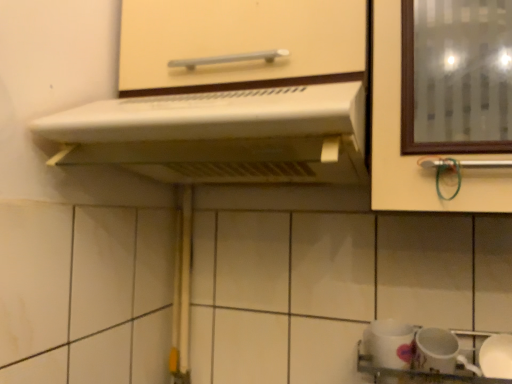
Question: From a real-world perspective, is white glossy mug at lower right, which appears as the second tableware when viewed from the right, above or below white glossy sink at lower right?

Choices:
 (A) above
 (B) below

Answer: (A)

Question: Considering their positions, is white glossy mug at lower right, placed as the first tableware when sorted from left to right, located in front of or behind white glossy sink at lower right?

Choices:
 (A) front
 (B) behind

Answer: (B)

Question: Which of these objects is positioned farthest from the white plastic range hood at upper center?

Choices:
 (A) white glossy sink at lower right
 (B) white glossy mug at lower right, placed as the first tableware when sorted from left to right
 (C) white glossy mug at lower right, the first tableware in the right-to-left sequence
 (D) matte white cabinet handle at upper center

Answer: (C)

Question: Estimate the real-world distances between objects in this image. Which object is closer to the white glossy mug at lower right, arranged as the second tableware when viewed from the left?

Choices:
 (A) white glossy sink at lower right
 (B) white glossy mug at lower right, placed as the first tableware when sorted from left to right
 (C) white plastic range hood at upper center
 (D) matte white cabinet handle at upper center

Answer: (A)